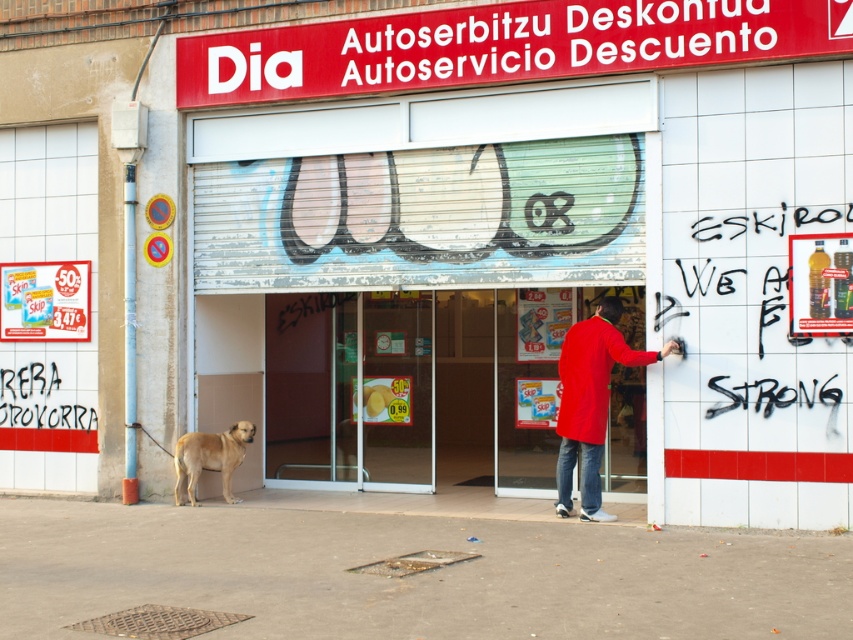
Which is in front, point (589, 380) or point (195, 442)?

Positioned in front is point (589, 380).

At what (x,y) coordinates should I click in order to perform the action: click on matte red coat at center. Please return your answer as a coordinate pair (x, y). The width and height of the screenshot is (853, 640). Looking at the image, I should click on (590, 401).

Is point (637, 326) less distant than point (558, 412)?

No, (637, 326) is behind (558, 412).

Who is taller, metallic silver door at center or matte red coat at center?

matte red coat at center is taller.

Is point (225, 164) positioned behind point (560, 465)?

Yes, point (225, 164) is behind point (560, 465).

At what (x,y) coordinates should I click in order to perform the action: click on metallic silver door at center. Please return your answer as a coordinate pair (x, y). Looking at the image, I should click on point(416,273).

Is black graffiti at right thinner than matte red coat at center?

In fact, black graffiti at right might be wider than matte red coat at center.

Who is positioned more to the left, black graffiti at right or matte red coat at center?

From the viewer's perspective, matte red coat at center appears more on the left side.

Find the location of `black graffiti at right`. black graffiti at right is located at coordinates (759, 305).

The image size is (853, 640). Identify the location of black graffiti at right. pyautogui.click(x=759, y=305).